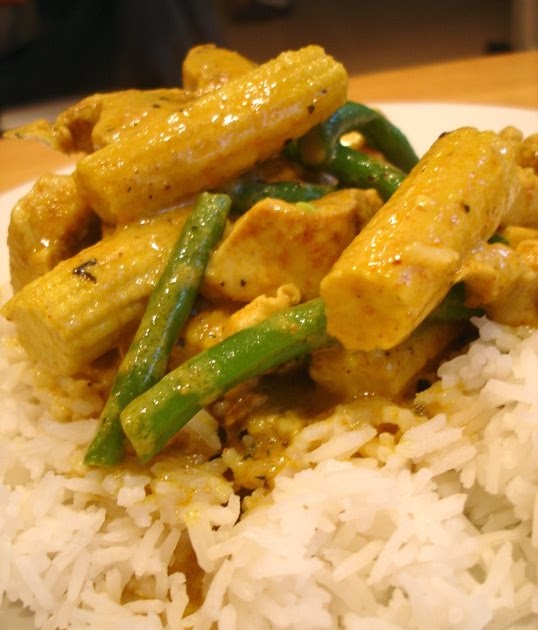
The height and width of the screenshot is (630, 538). I want to click on black piece in floor, so click(x=502, y=46).